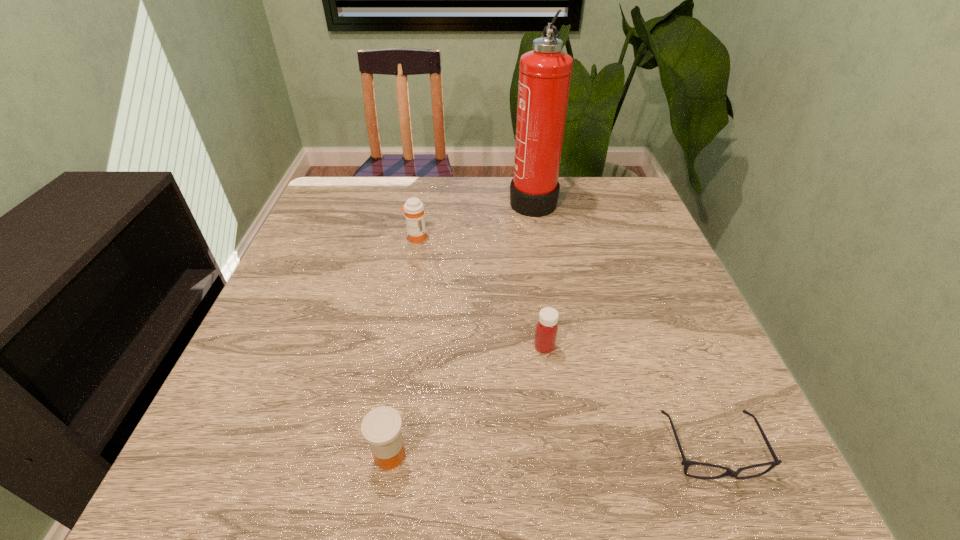
Find the location of `free space at the left edge`. free space at the left edge is located at coordinates (245, 414).

Find the location of a particular element. vacant area at the right edge of the desktop is located at coordinates (631, 267).

The width and height of the screenshot is (960, 540). I want to click on free space at the far left corner of the desktop, so click(371, 215).

Where is `vacant point at the far right corner`? The image size is (960, 540). vacant point at the far right corner is located at coordinates (636, 218).

You are a GUI agent. You are given a task and a screenshot of the screen. Output one action in this format:
    pyautogui.click(x=<x>, y=<y>)
    Task: Click on the empty space between the spectacles and the rightmost medicine
    
    Given the screenshot: What is the action you would take?
    pyautogui.click(x=628, y=398)

Where is `vacant area that lies between the rightmost medicine and the second farthest object`? vacant area that lies between the rightmost medicine and the second farthest object is located at coordinates (480, 292).

Locate an element on the screen. This screenshot has width=960, height=540. free point between the fire extinguisher and the fourth nearest object is located at coordinates (474, 218).

Find the location of a particular element. This screenshot has height=540, width=960. free area in between the farthest object and the second farthest object is located at coordinates (474, 218).

Find the location of a particular element. The image size is (960, 540). free space that is in between the fire extinguisher and the spectacles is located at coordinates (622, 325).

The image size is (960, 540). Find the location of `free point between the second farthest object and the farthest object`. free point between the second farthest object and the farthest object is located at coordinates (474, 218).